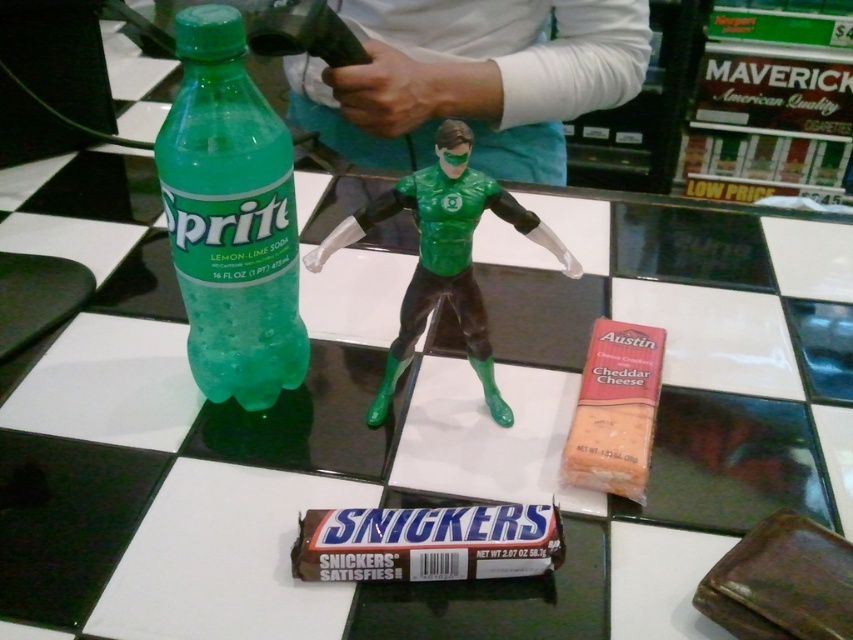
Question: Estimate the real-world distances between objects in this image. Which object is closer to the brown cardboard snickers bar at lower center?

Choices:
 (A) translucent green plastic bottle at left
 (B) green plastic toy at center

Answer: (A)

Question: Can you confirm if chocolate brown candy bar at lower center is wider than brown cardboard snickers bar at lower center?

Choices:
 (A) no
 (B) yes

Answer: (B)

Question: Among these objects, which one is farthest from the camera?

Choices:
 (A) brown cardboard snickers bar at lower center
 (B) chocolate brown candy bar at lower center
 (C) translucent green plastic bottle at left

Answer: (B)

Question: Does green plastic toy at center appear over chocolate brown candy bar at lower center?

Choices:
 (A) no
 (B) yes

Answer: (B)

Question: Which point is closer to the camera?

Choices:
 (A) brown cardboard snickers bar at lower center
 (B) chocolate brown candy bar at lower center

Answer: (A)

Question: Can you confirm if green plastic toy at center is positioned to the right of brown cardboard snickers bar at lower center?

Choices:
 (A) yes
 (B) no

Answer: (B)